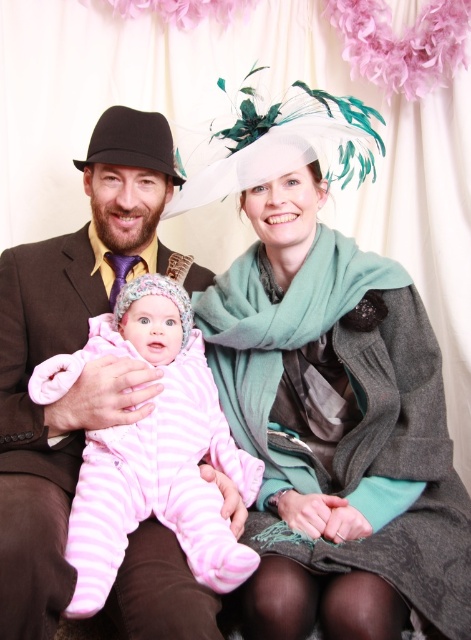
Can you confirm if white matte hat at upper center is bigger than pink fleece onesie at center?

Yes, white matte hat at upper center is bigger than pink fleece onesie at center.

Does white matte hat at upper center have a smaller size compared to pink fleece onesie at center?

No.

Identify the location of white matte hat at upper center. (331, 397).